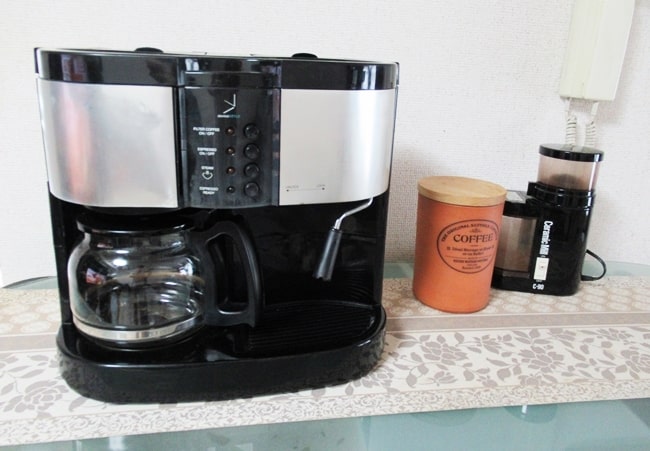
Find the location of a particular element. The width and height of the screenshot is (650, 451). espresso/coffee maker base is located at coordinates (229, 382).